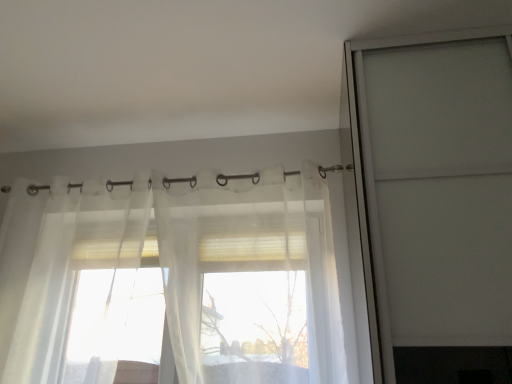
Question: Is transparent glass screen door at upper right smaller than sheer white curtain at center?

Choices:
 (A) yes
 (B) no

Answer: (B)

Question: From the image's perspective, is transparent glass screen door at upper right under sheer white curtain at center?

Choices:
 (A) no
 (B) yes

Answer: (A)

Question: Could you tell me if transparent glass screen door at upper right is turned towards sheer white curtain at center?

Choices:
 (A) no
 (B) yes

Answer: (A)

Question: Is transparent glass screen door at upper right to the right of sheer white curtain at center from the viewer's perspective?

Choices:
 (A) yes
 (B) no

Answer: (A)

Question: Is transparent glass screen door at upper right shorter than sheer white curtain at center?

Choices:
 (A) yes
 (B) no

Answer: (B)

Question: In terms of width, does sheer white curtain at center look wider or thinner when compared to translucent fabric curtain at upper center?

Choices:
 (A) wide
 (B) thin

Answer: (A)

Question: From a real-world perspective, is sheer white curtain at center positioned above or below translucent fabric curtain at upper center?

Choices:
 (A) below
 (B) above

Answer: (A)

Question: Is point (267, 243) closer or farther from the camera than point (292, 173)?

Choices:
 (A) closer
 (B) farther

Answer: (A)

Question: In terms of height, does sheer white curtain at center look taller or shorter compared to translucent fabric curtain at upper center?

Choices:
 (A) short
 (B) tall

Answer: (B)

Question: Considering the positions of translucent fabric curtain at upper center and transparent glass screen door at upper right in the image, is translucent fabric curtain at upper center taller or shorter than transparent glass screen door at upper right?

Choices:
 (A) tall
 (B) short

Answer: (B)

Question: Looking at their shapes, would you say translucent fabric curtain at upper center is wider or thinner than transparent glass screen door at upper right?

Choices:
 (A) thin
 (B) wide

Answer: (A)

Question: Is translucent fabric curtain at upper center in front of or behind transparent glass screen door at upper right in the image?

Choices:
 (A) behind
 (B) front

Answer: (A)

Question: Is translucent fabric curtain at upper center bigger or smaller than transparent glass screen door at upper right?

Choices:
 (A) small
 (B) big

Answer: (A)

Question: Visually, is translucent fabric curtain at upper center positioned to the left or to the right of sheer white curtain at center?

Choices:
 (A) left
 (B) right

Answer: (A)

Question: In terms of width, does translucent fabric curtain at upper center look wider or thinner when compared to sheer white curtain at center?

Choices:
 (A) wide
 (B) thin

Answer: (B)